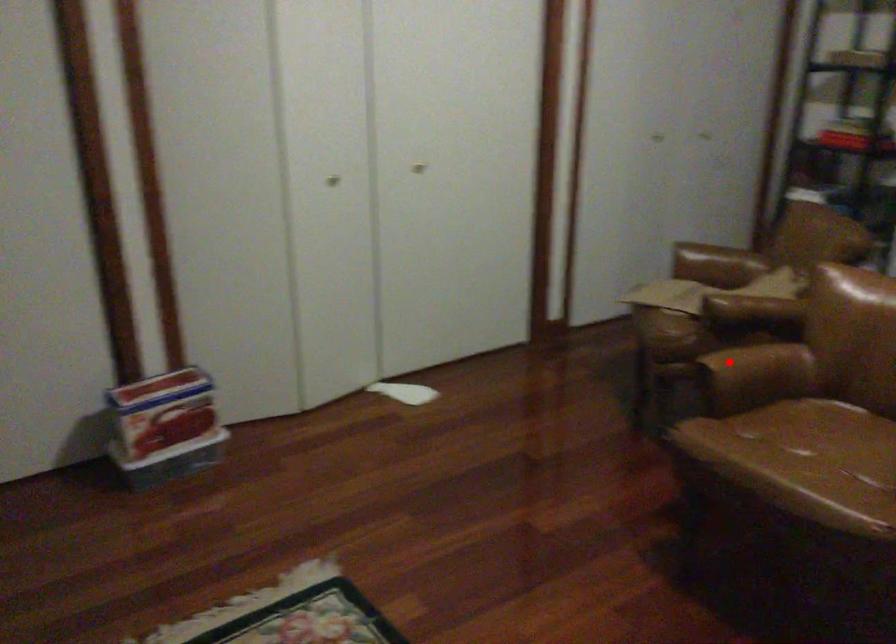
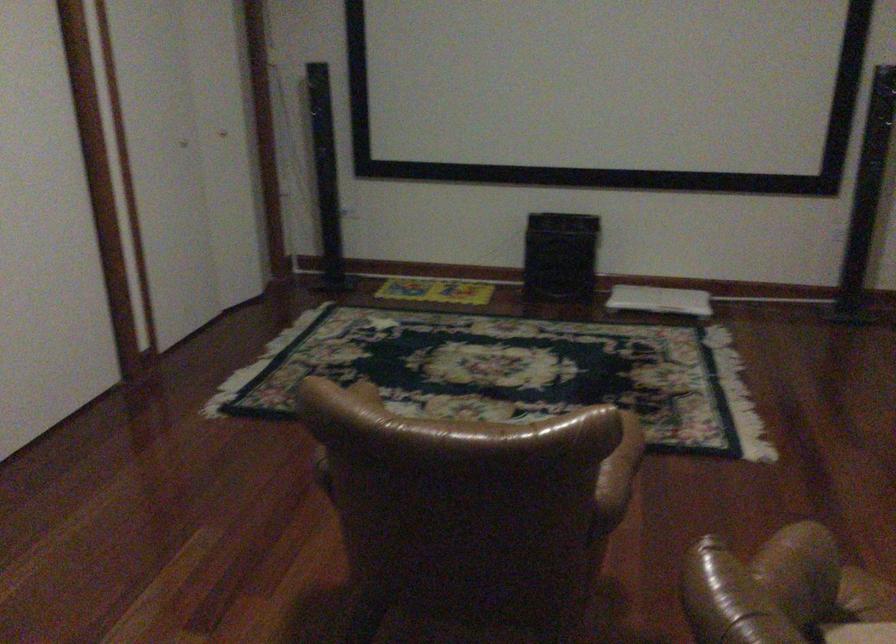
In the second image, find the point that corresponds to the highlighted location in the first image.

(622, 460)